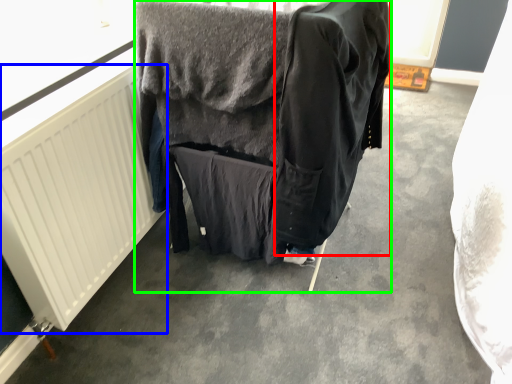
Question: Which object is the farthest from clothing (highlighted by a red box)? Choose among these: radiator (highlighted by a blue box) or furniture (highlighted by a green box).

Choices:
 (A) radiator
 (B) furniture

Answer: (A)